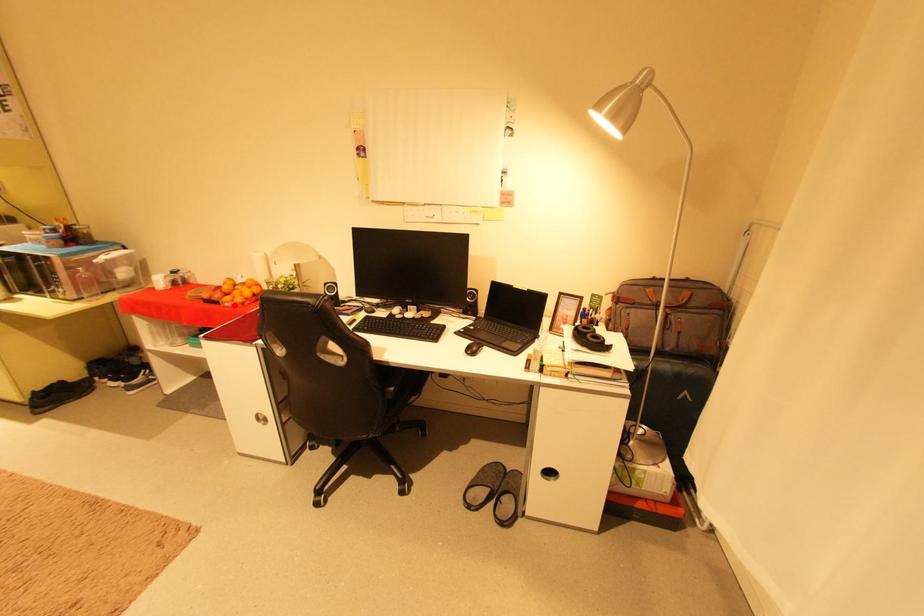
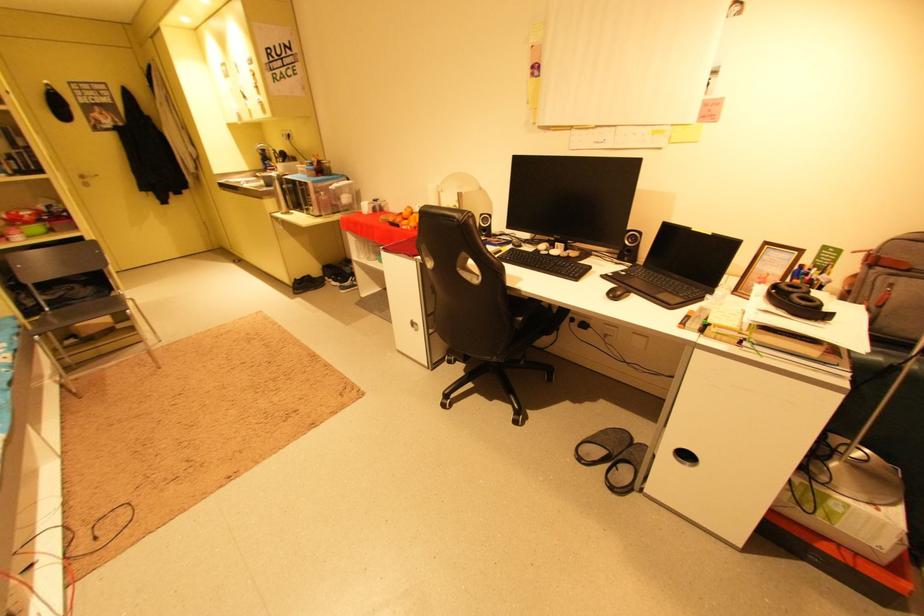
Question: A red point is marked in image1. In image2, is the corresponding 3D point closer to the camera or farther? Reply with the corresponding letter.

Choices:
 (A) The corresponding 3D point is closer.
 (B) The corresponding 3D point is farther.

Answer: (A)